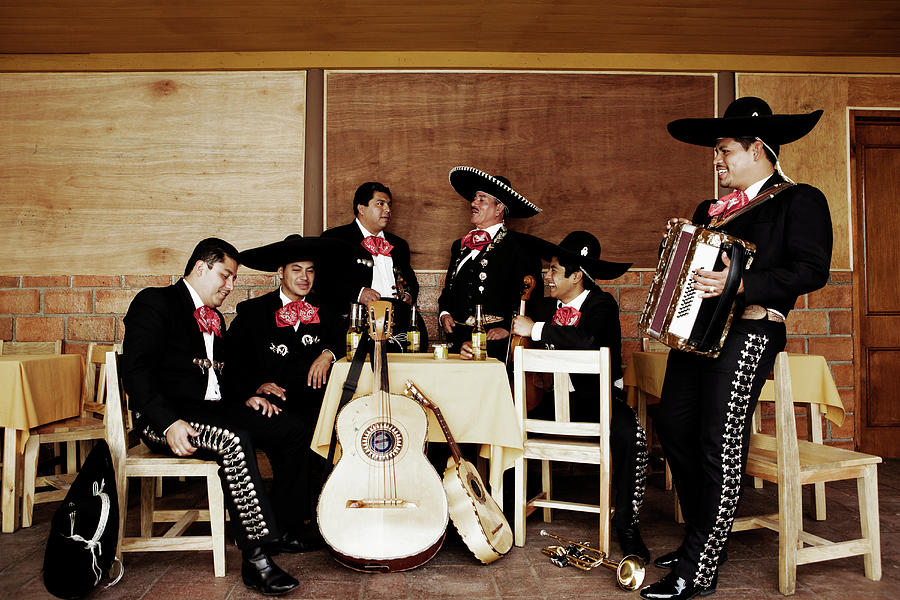
This screenshot has width=900, height=600. In order to click on chair in this screenshot , I will do `click(551, 381)`.